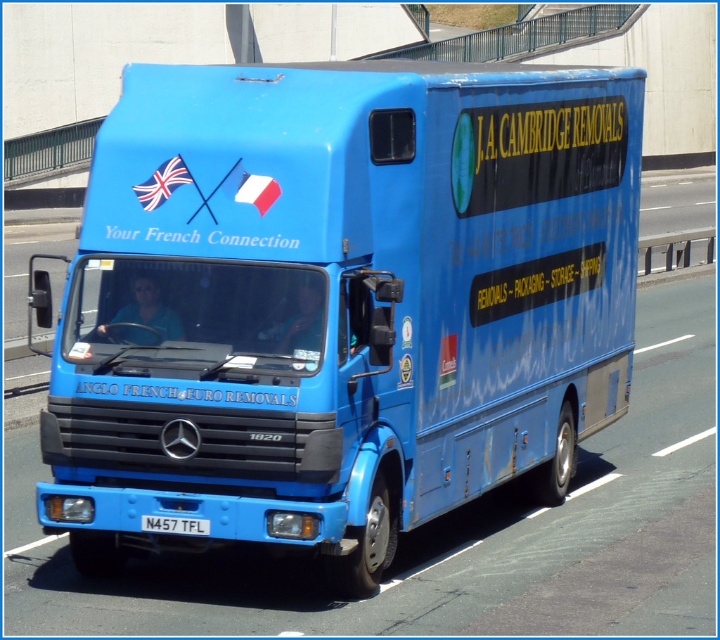
You are a delivery driver who needs to attach a new flag to the blue matte truck at center. You have a flag that is the same size as the blue fabric flag at upper left. Where should you place the new flag so it doesn not block the truck registration plate?

Since the blue fabric flag at upper left is behind the blue matte truck at center, placing the new flag in front of the truck would ensure it doesn not block the registration plate.

You are a delivery person who needs to park your 2.5 meters tall van behind the blue matte truck at center. There is a blue fabric flag at upper left attached to a pole. Can your van fit under the flag without hitting it?

The blue matte truck at center is not as tall as the blue fabric flag at upper left, meaning the flag is taller. Since your van is 2.5 meters tall, it should safely pass under the flag as long as the flagpole isn

You are a delivery driver who needs to attach a new flag to the truck. The new flag must be narrower than both existing flags. Where should you place it so that it fits between the blue fabric flag at upper left and the blue fabric flag at center without overlapping either?

The new flag should be placed between the blue fabric flag at upper left and the blue fabric flag at center. Since the blue fabric flag at upper left might be wider than blue fabric flag at center, the narrower new flag can fit in the space between them without overlapping.